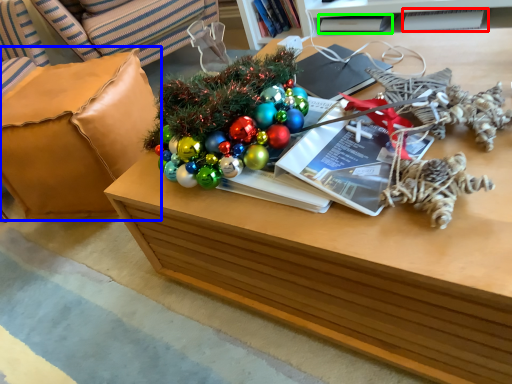
Question: Which object is the closest to the magazine (highlighted by a red box)? Choose among these: armchair (highlighted by a blue box) or book (highlighted by a green box).

Choices:
 (A) armchair
 (B) book

Answer: (B)